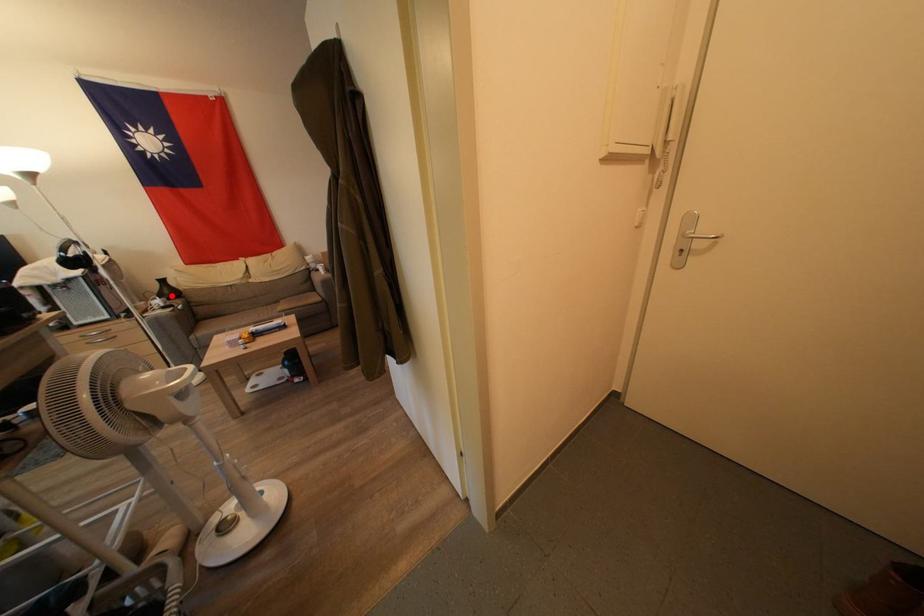
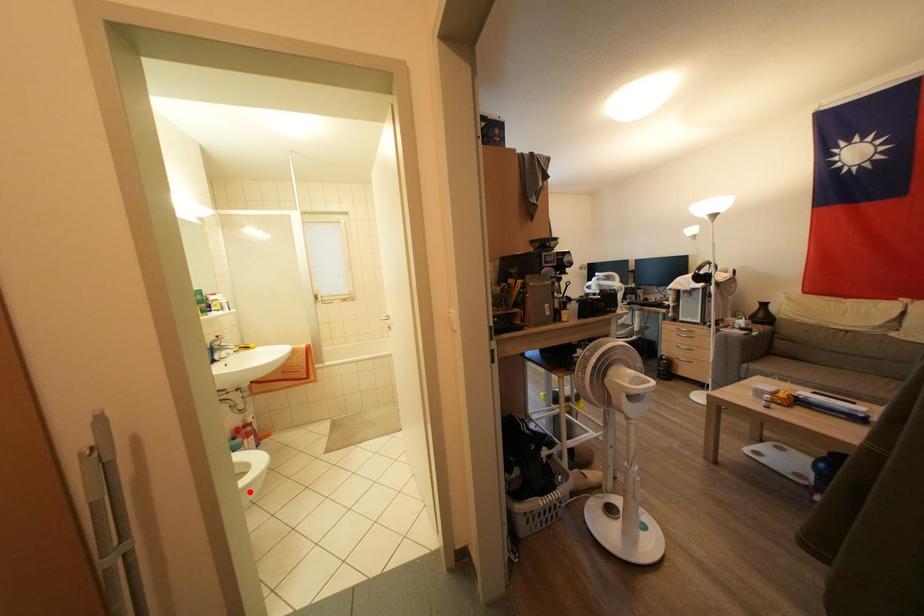
I am providing you with two images of the same scene from different viewpoints. A red point is marked on the first image and another point is marked on the second image. Is the red point in image1 aligned with the point shown in image2?

No